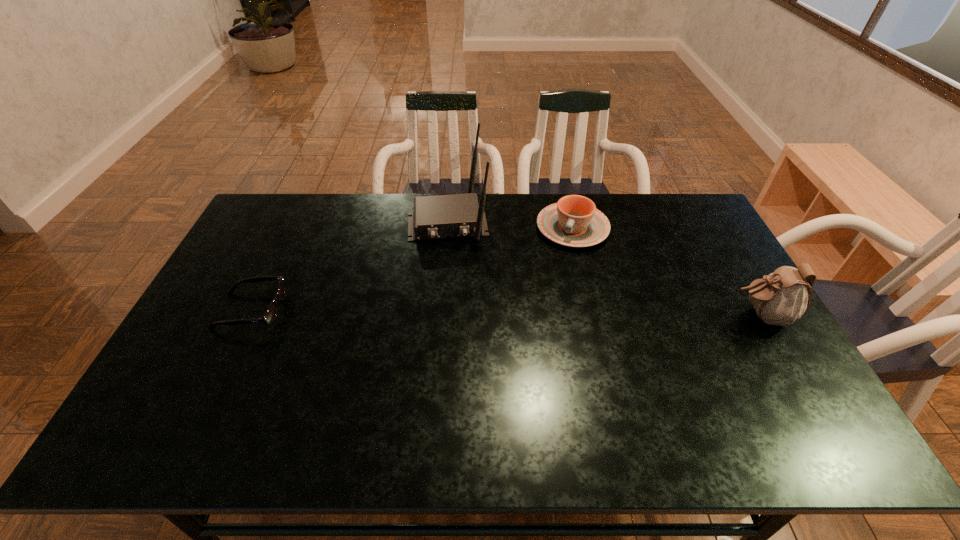
You are a GUI agent. You are given a task and a screenshot of the screen. Output one action in this format:
    pyautogui.click(x=<x>, y=<y>)
    Task: Click on the vacant region located 0.250m on the front-facing side of the rightmost object
    The height and width of the screenshot is (540, 960).
    Given the screenshot: What is the action you would take?
    pyautogui.click(x=644, y=315)

The height and width of the screenshot is (540, 960). In order to click on vacant space located on the front-facing side of the rightmost object in this screenshot , I will do `click(644, 315)`.

Identify the location of vacant position located on the back of the router to connect cables. Image resolution: width=960 pixels, height=540 pixels. (454, 285).

Where is `vacant point located 0.220m on the back of the router to connect cables`? Image resolution: width=960 pixels, height=540 pixels. vacant point located 0.220m on the back of the router to connect cables is located at coordinates (455, 294).

Where is `vacant space positioned 0.220m on the back of the router to connect cables`? This screenshot has height=540, width=960. vacant space positioned 0.220m on the back of the router to connect cables is located at coordinates (455, 294).

The width and height of the screenshot is (960, 540). Find the location of `vacant area situated on the handle side of the second shortest object`. vacant area situated on the handle side of the second shortest object is located at coordinates (536, 316).

Locate an element on the screen. This screenshot has height=540, width=960. free point located 0.290m on the handle side of the second shortest object is located at coordinates (538, 311).

Where is `vacant region located 0.320m on the handle side of the second shortest object`? This screenshot has width=960, height=540. vacant region located 0.320m on the handle side of the second shortest object is located at coordinates (535, 319).

At what (x,y) coordinates should I click in order to perform the action: click on router that is at the far edge. Please return your answer as a coordinate pair (x, y). The image size is (960, 540). Looking at the image, I should click on [435, 217].

Locate an element on the screen. The image size is (960, 540). chinaware situated at the far edge is located at coordinates (574, 221).